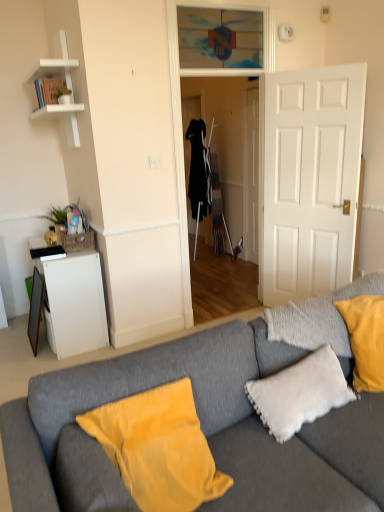
Question: Is gray fabric couch at center positioned beyond the bounds of transparent glass door at center?

Choices:
 (A) no
 (B) yes

Answer: (B)

Question: Is gray fabric couch at center positioned with its back to transparent glass door at center?

Choices:
 (A) yes
 (B) no

Answer: (A)

Question: From a real-world perspective, is gray fabric couch at center positioned under transparent glass door at center based on gravity?

Choices:
 (A) no
 (B) yes

Answer: (B)

Question: Considering the relative sizes of gray fabric couch at center and transparent glass door at center in the image provided, is gray fabric couch at center shorter than transparent glass door at center?

Choices:
 (A) yes
 (B) no

Answer: (A)

Question: Are gray fabric couch at center and transparent glass door at center beside each other?

Choices:
 (A) no
 (B) yes

Answer: (A)

Question: From the image's perspective, does gray fabric couch at center appear lower than transparent glass door at center?

Choices:
 (A) yes
 (B) no

Answer: (A)

Question: Considering the relative sizes of green leafy plant at upper left and white matte door at center in the image provided, is green leafy plant at upper left shorter than white matte door at center?

Choices:
 (A) yes
 (B) no

Answer: (A)

Question: Does green leafy plant at upper left have a smaller size compared to white matte door at center?

Choices:
 (A) no
 (B) yes

Answer: (B)

Question: Would you say green leafy plant at upper left is a long distance from white matte door at center?

Choices:
 (A) yes
 (B) no

Answer: (A)

Question: Considering the relative positions of green leafy plant at upper left and white matte door at center in the image provided, is green leafy plant at upper left to the right of white matte door at center from the viewer's perspective?

Choices:
 (A) no
 (B) yes

Answer: (A)

Question: Are green leafy plant at upper left and white matte door at center making contact?

Choices:
 (A) no
 (B) yes

Answer: (A)

Question: Is green leafy plant at upper left not inside white matte door at center?

Choices:
 (A) yes
 (B) no

Answer: (A)

Question: Is transparent glass door at center positioned with its back to transparent glass door at upper center?

Choices:
 (A) no
 (B) yes

Answer: (A)